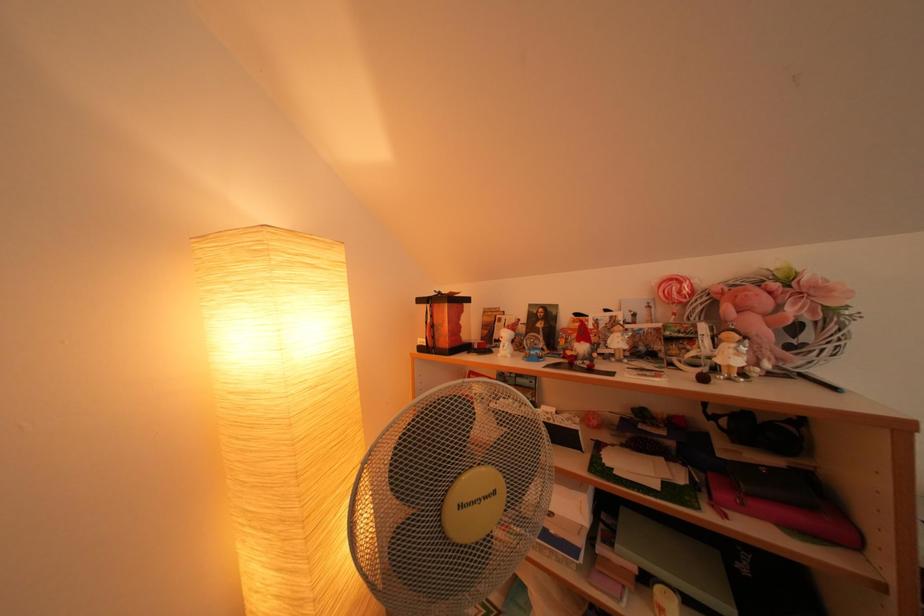
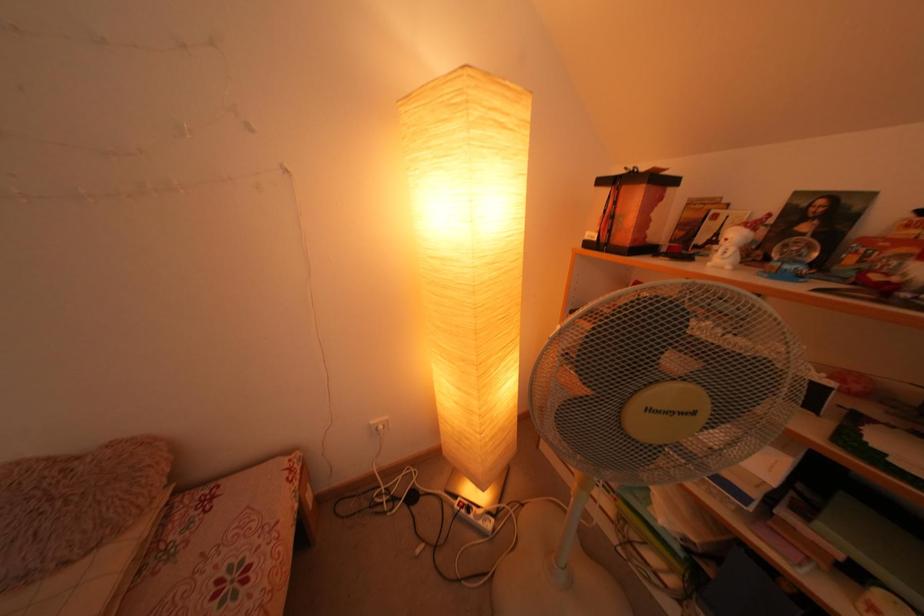
First-person continuous shooting, in which direction is the camera rotating?

The rotation direction of the camera is left-down.